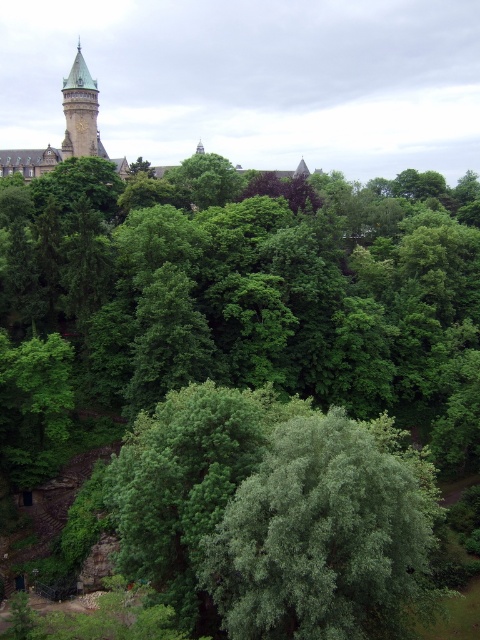
Between point (312, 634) and point (74, 141), which one is positioned in front?

Point (312, 634) is more forward.

What do you see at coordinates (326, 536) in the screenshot?
I see `green leafy tree at center` at bounding box center [326, 536].

Is point (355, 516) farther from camera compared to point (1, 156)?

No.

The image size is (480, 640). Find the location of `green leafy tree at center`. green leafy tree at center is located at coordinates (326, 536).

You are a GUI agent. You are given a task and a screenshot of the screen. Output one action in this format:
    pyautogui.click(x=<x>, y=<y>)
    Task: Click on the stone tower at upper left
    
    Given the screenshot: What is the action you would take?
    pyautogui.click(x=67, y=131)

Which is behind, point (71, 84) or point (83, 65)?

Positioned behind is point (83, 65).

What are the coordinates of `stone tower at upper left` in the screenshot? It's located at (67, 131).

Is point (360, 547) positioned after point (94, 131)?

No.

Between green leafy tree at center and green stone tower at upper left, which one has more height?

green stone tower at upper left is taller.

The height and width of the screenshot is (640, 480). What are the coordinates of `green leafy tree at center` in the screenshot? It's located at (326, 536).

Identify the location of green leafy tree at center. Image resolution: width=480 pixels, height=640 pixels. (326, 536).